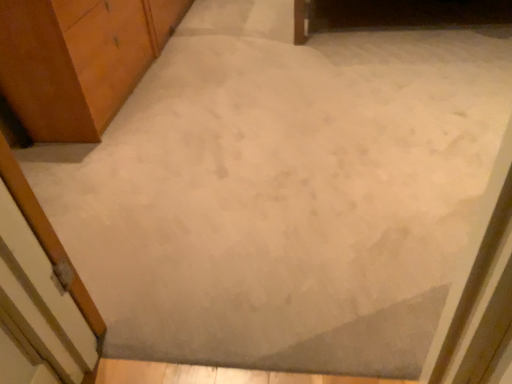
Locate an element on the screen. The width and height of the screenshot is (512, 384). matte wood cabinet at upper left is located at coordinates (78, 60).

What do you see at coordinates (78, 60) in the screenshot?
I see `matte wood cabinet at upper left` at bounding box center [78, 60].

Identify the location of matte wood cabinet at upper left. This screenshot has height=384, width=512. (78, 60).